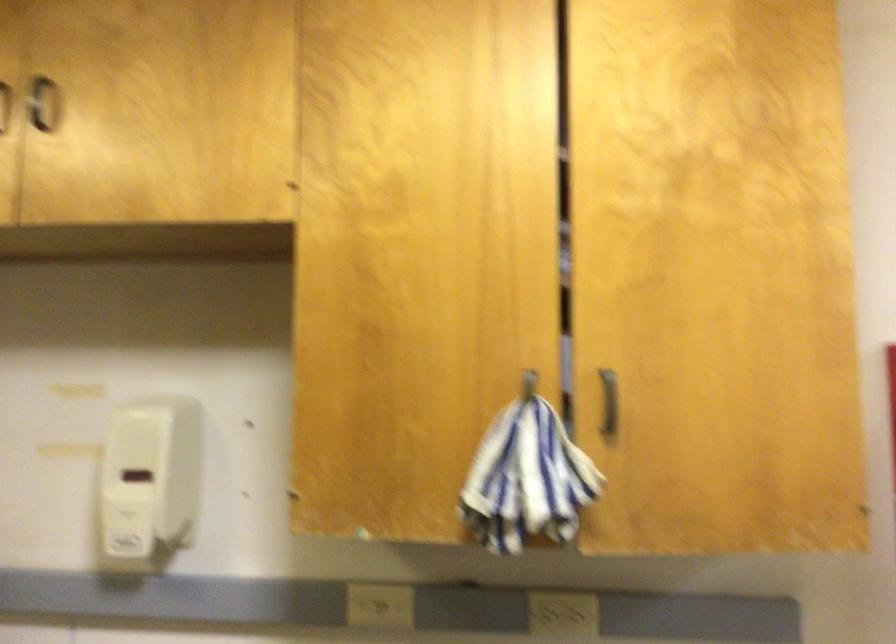
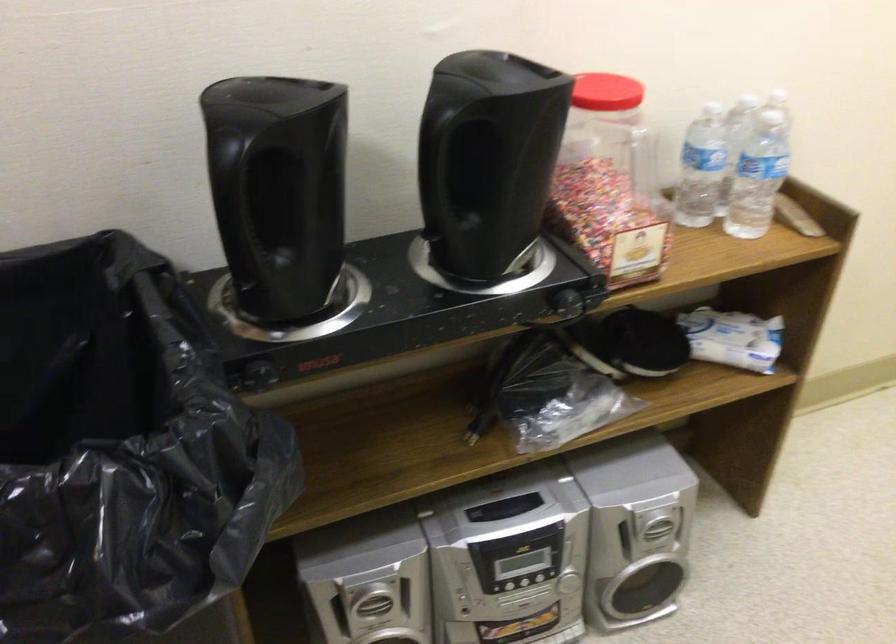
How did the camera likely rotate?

The rotation direction of the camera is right-down.